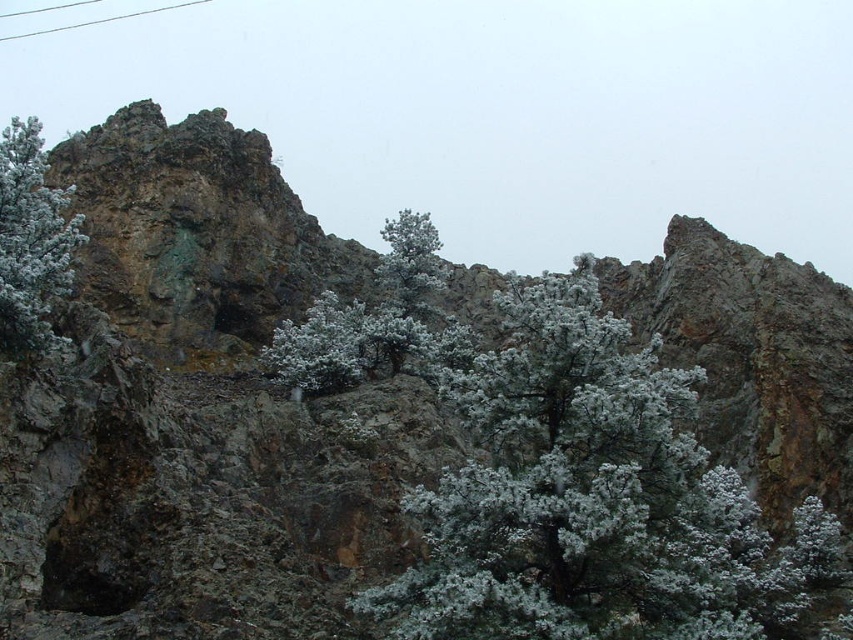
Question: Can you confirm if snow-covered pine tree at left is thinner than white snow-covered tree at center?

Choices:
 (A) no
 (B) yes

Answer: (A)

Question: Which object is the closest to the white snow-covered tree at center?

Choices:
 (A) snow-covered pine tree at left
 (B) snow-covered evergreen at center

Answer: (B)

Question: Is snow-covered evergreen at center above snow-covered pine tree at left?

Choices:
 (A) yes
 (B) no

Answer: (B)

Question: Does snow-covered evergreen at center appear over white snow-covered tree at center?

Choices:
 (A) yes
 (B) no

Answer: (B)

Question: Which of the following is the closest to the observer?

Choices:
 (A) white snow-covered tree at center
 (B) snow-covered evergreen at center
 (C) snow-covered pine tree at left

Answer: (B)

Question: Which object is the farthest from the white snow-covered tree at center?

Choices:
 (A) snow-covered pine tree at left
 (B) snow-covered evergreen at center

Answer: (A)